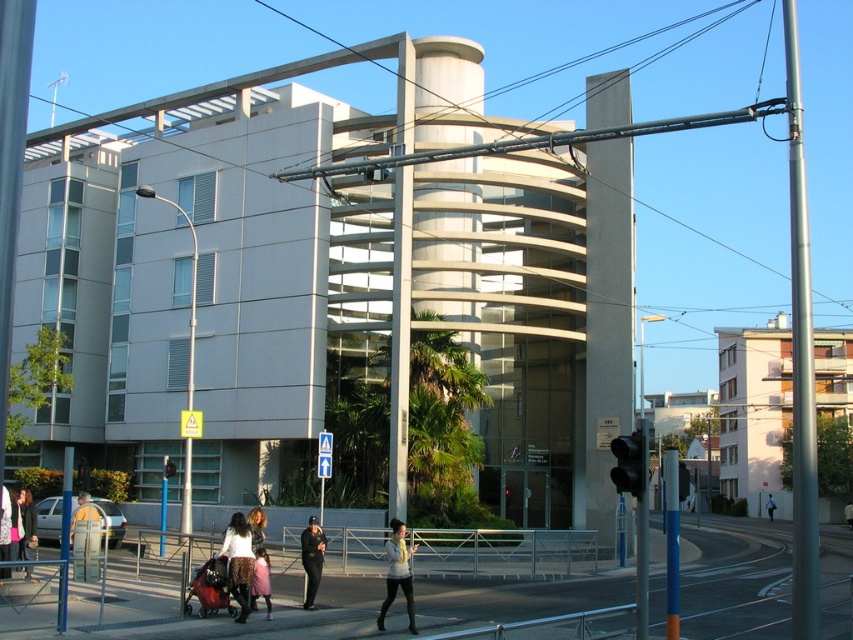
Question: Does white textured coat at lower center appear over light brown leather jacket at lower left?

Choices:
 (A) no
 (B) yes

Answer: (A)

Question: Which point is farther to the camera?

Choices:
 (A) light brown leather jacket at lower left
 (B) white textured coat at center

Answer: (B)

Question: Which point is closer to the camera?

Choices:
 (A) (222, 545)
 (B) (387, 586)
 (C) (799, 560)
 (D) (68, 454)

Answer: (C)

Question: Does light beige sweater at center appear on the left side of white cotton jacket at lower left?

Choices:
 (A) no
 (B) yes

Answer: (A)

Question: Among these points, which one is farthest from the camera?

Choices:
 (A) (322, 554)
 (B) (65, 529)

Answer: (A)

Question: Is pink fabric coat at center below white fabric bag at center?

Choices:
 (A) yes
 (B) no

Answer: (B)